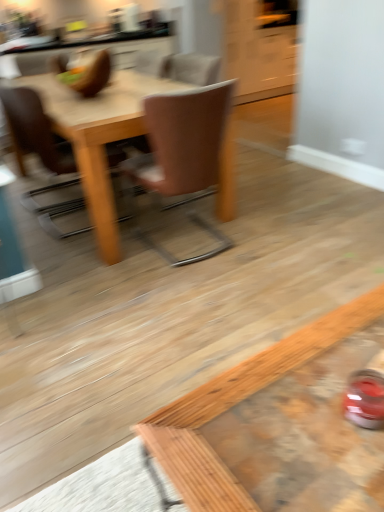
Where is `vacant space situated above wooden coffee table at lower right (from a real-world perspective)`? vacant space situated above wooden coffee table at lower right (from a real-world perspective) is located at coordinates (306, 402).